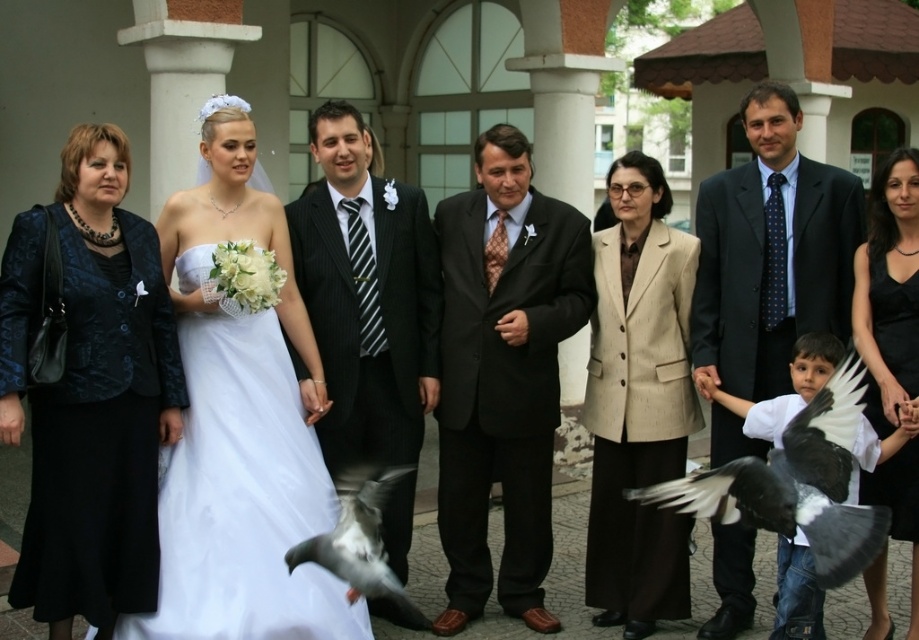
Is white satin dress at center behind beige textured blazer at center?

No, it is in front of beige textured blazer at center.

Can you confirm if white satin dress at center is positioned to the right of beige textured blazer at center?

In fact, white satin dress at center is to the left of beige textured blazer at center.

Which is behind, point (231, 216) or point (634, 161)?

The point (634, 161) is behind.

This screenshot has width=919, height=640. Find the location of `white satin dress at center`. white satin dress at center is located at coordinates (240, 426).

Is point (861, 522) closer to viewer compared to point (893, 497)?

Yes.

Identify the location of black feathered bird at lower right. (796, 484).

Between point (795, 500) and point (885, 392), which one is positioned in front?

Point (795, 500) is in front.

The width and height of the screenshot is (919, 640). I want to click on black feathered bird at lower right, so click(796, 484).

Does beige textured blazer at center appear on the right side of black satin dress at center?

Incorrect, beige textured blazer at center is not on the right side of black satin dress at center.

Who is taller, beige textured blazer at center or black satin dress at center?

beige textured blazer at center

Is point (667, 253) positioned in front of point (887, 164)?

No, it is not.

This screenshot has width=919, height=640. Identify the location of beige textured blazer at center. (638, 403).